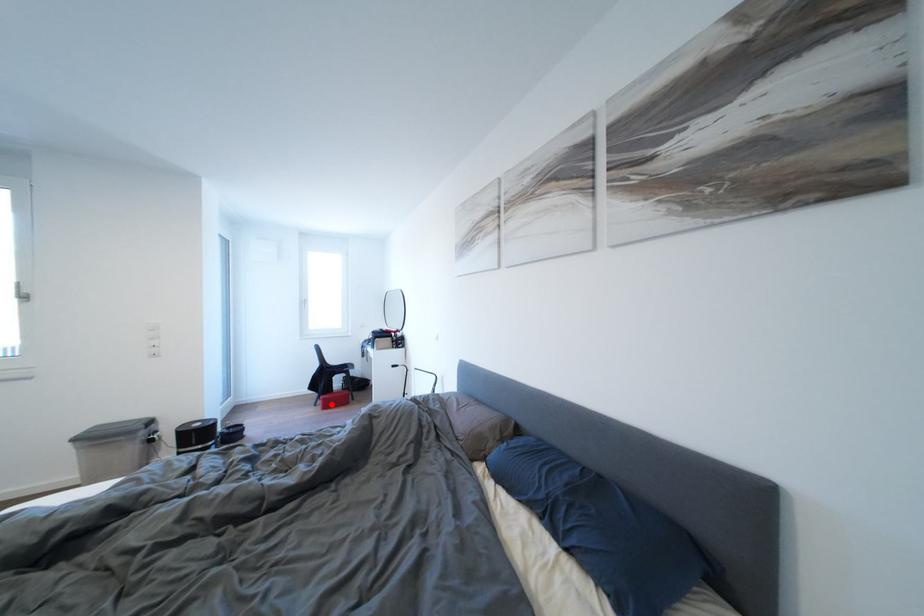
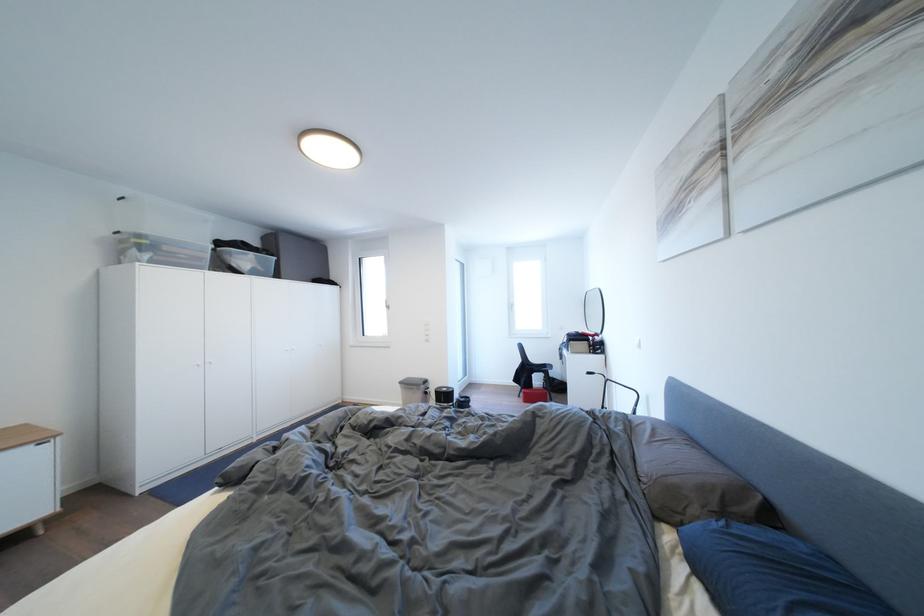
In the second image, find the point that corresponds to the highlighted location in the first image.

(532, 398)